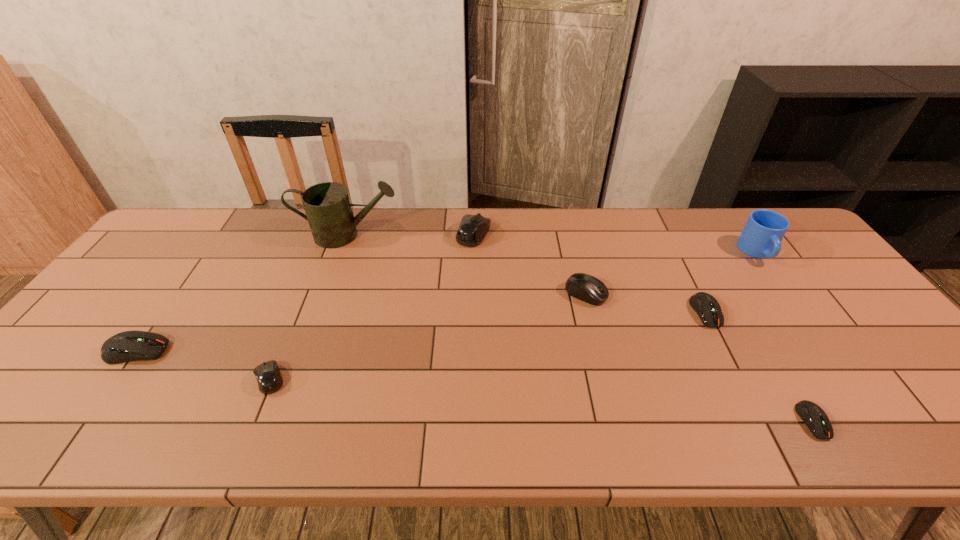
Find the location of a particular element. The height and width of the screenshot is (540, 960). free location located 0.110m on the button of the biggest dark computer equipment is located at coordinates (212, 351).

Locate an element on the screen. vacant space located on the button of the second computer equipment from right to left is located at coordinates (759, 418).

I want to click on free space located 0.080m on the left of the nearest black mouse, so click(x=220, y=379).

This screenshot has width=960, height=540. I want to click on watering can that is positioned at the far edge, so click(327, 205).

Where is `mug that is at the far edge`? mug that is at the far edge is located at coordinates (761, 237).

Find the location of a particular element. This screenshot has height=540, width=960. mouse that is at the far edge is located at coordinates (473, 228).

In order to click on object present at the near edge in this screenshot , I will do `click(815, 418)`.

In order to click on object located at the left edge in this screenshot , I will do `click(127, 346)`.

Find the location of a particular element. The height and width of the screenshot is (540, 960). object located in the right edge section of the desktop is located at coordinates (761, 237).

Where is `object that is at the far right corner`? The image size is (960, 540). object that is at the far right corner is located at coordinates (761, 237).